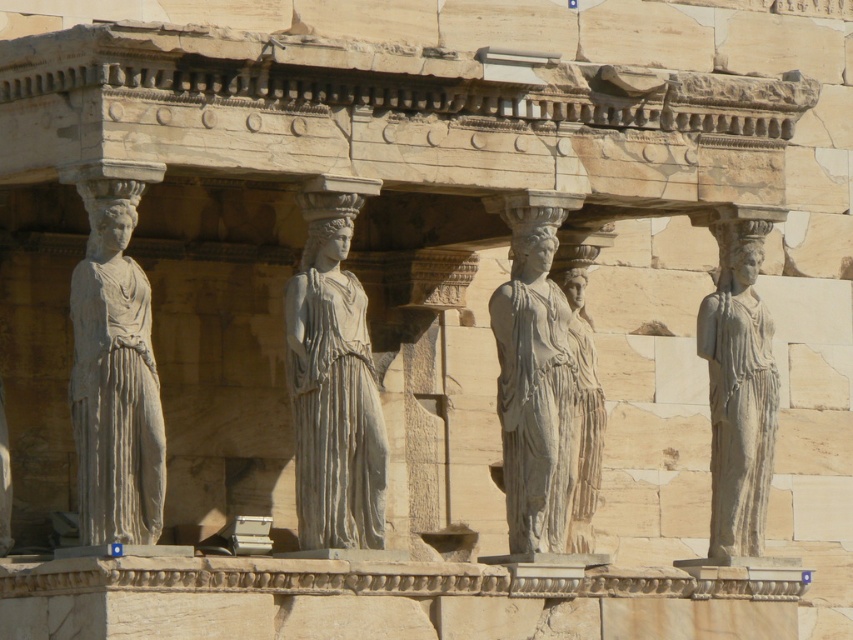
You are standing in front of the Caryatid Porch of the Erechtheion temple. You notice a point marked at coordinates (338, 465). Considering your distance from this point is 62.76 meters, can you estimate how far you are from this specific point in the structure?

The point at coordinates (338, 465) is 62.76 meters away from you, so you are 62.76 meters away from this point in the structure.

Based on the scene of the Erechtheion temple, which object is positioned to the right of the other between the light gray stone caryatid at left and the gray stone statue at center?

The gray stone statue at center is positioned to the right of the light gray stone caryatid at left, as the light gray stone caryatid at left is to the left of the gray stone statue at center.